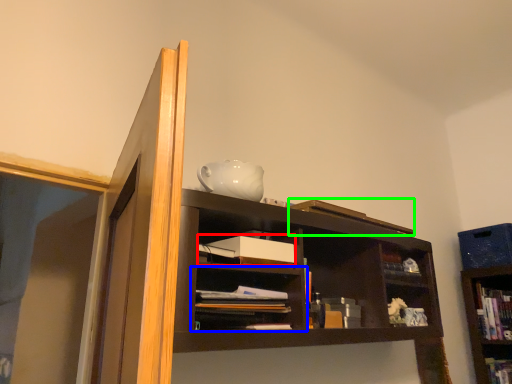
Question: Estimate the real-world distances between objects in this image. Which object is closer to paperback book (highlighted by a red box), shelf (highlighted by a blue box) or book (highlighted by a green box)?

Choices:
 (A) shelf
 (B) book

Answer: (A)